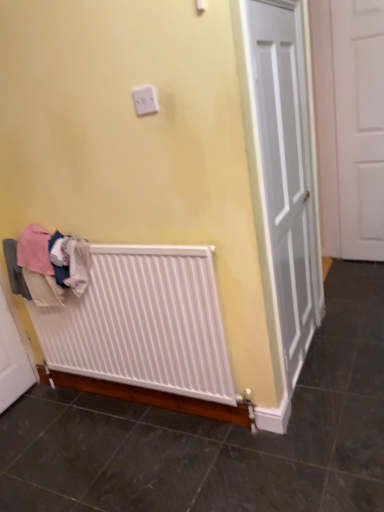
Question: Is white matte radiator at lower left facing away from white plastic outlet at upper center?

Choices:
 (A) yes
 (B) no

Answer: (B)

Question: Can you confirm if white matte radiator at lower left is positioned to the left of white plastic outlet at upper center?

Choices:
 (A) no
 (B) yes

Answer: (B)

Question: Does white matte radiator at lower left appear on the right side of white plastic outlet at upper center?

Choices:
 (A) yes
 (B) no

Answer: (B)

Question: Does white matte radiator at lower left have a larger size compared to white plastic outlet at upper center?

Choices:
 (A) yes
 (B) no

Answer: (A)

Question: Are white matte radiator at lower left and white plastic outlet at upper center located far from each other?

Choices:
 (A) yes
 (B) no

Answer: (B)

Question: Is white matte radiator at lower left thinner than white plastic outlet at upper center?

Choices:
 (A) no
 (B) yes

Answer: (A)

Question: Would you consider white cotton clothes at lower left to be distant from white plastic outlet at upper center?

Choices:
 (A) yes
 (B) no

Answer: (B)

Question: Is white cotton clothes at lower left thinner than white plastic outlet at upper center?

Choices:
 (A) yes
 (B) no

Answer: (B)

Question: Is white cotton clothes at lower left aimed at white plastic outlet at upper center?

Choices:
 (A) yes
 (B) no

Answer: (B)

Question: Is white cotton clothes at lower left oriented away from white plastic outlet at upper center?

Choices:
 (A) yes
 (B) no

Answer: (B)

Question: Is white cotton clothes at lower left placed right next to white plastic outlet at upper center?

Choices:
 (A) yes
 (B) no

Answer: (B)

Question: Is white cotton clothes at lower left at the left side of white plastic outlet at upper center?

Choices:
 (A) no
 (B) yes

Answer: (B)

Question: Is white matte radiator at lower left positioned behind white matte door at right?

Choices:
 (A) yes
 (B) no

Answer: (B)